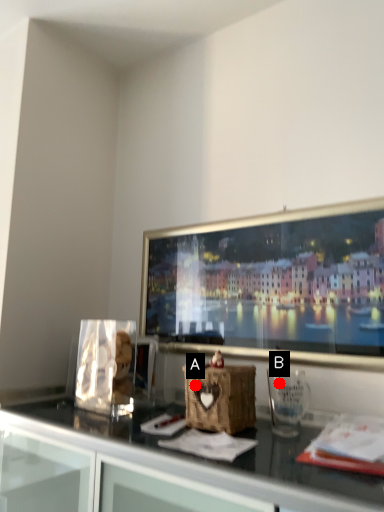
Question: Two points are circled on the image, labeled by A and B beside each circle. Which point is closer to the camera?

Choices:
 (A) A is closer
 (B) B is closer

Answer: (A)